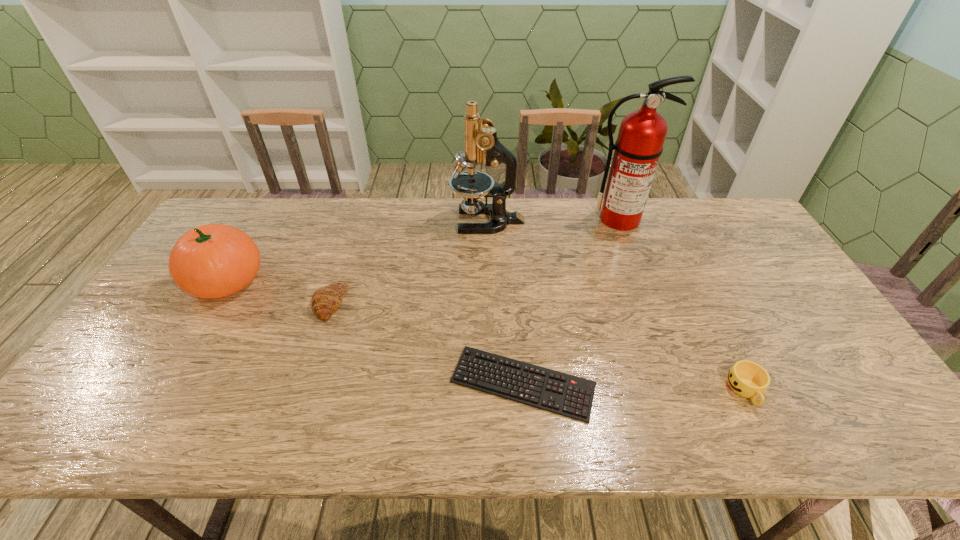
At what (x,y) coordinates should I click in order to perform the action: click on vacant area in the image that satisfies the following two spatial constraints: 1. at the nozzle of the fire extinguisher; 2. at the eyepiece of the microscope. Please return your answer as a coordinate pair (x, y). The image size is (960, 540). Looking at the image, I should click on (620, 221).

Find the location of a particular element. vacant space that satisfies the following two spatial constraints: 1. at the eyepiece of the second tallest object; 2. on the back side of the shortest object is located at coordinates (490, 383).

This screenshot has width=960, height=540. I want to click on free location that satisfies the following two spatial constraints: 1. at the nozzle of the fire extinguisher; 2. at the eyepiece of the microscope, so click(620, 221).